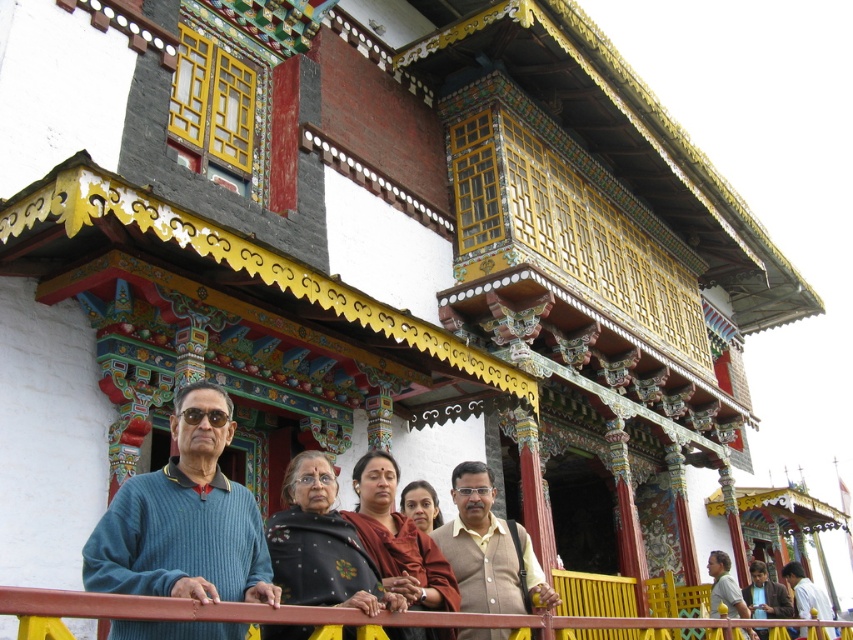
You are standing in front of the traditional building and see the group of people. There is a point marked at coordinates (488, 548). What object in the scene corresponds to this point?

The point at coordinates (488, 548) corresponds to the brown textured sweater at center.

You are a photographer trying to capture a photo of the group while ensuring the metallic red railing at lower center and the brown textured sweater at center are both visible. Based on their heights, which object will be partially hidden if you focus on the lower part of the scene?

The metallic red railing at lower center is taller than the brown textured sweater at center, so if focusing on the lower part, the brown textured sweater at center might be partially hidden behind the taller railing.